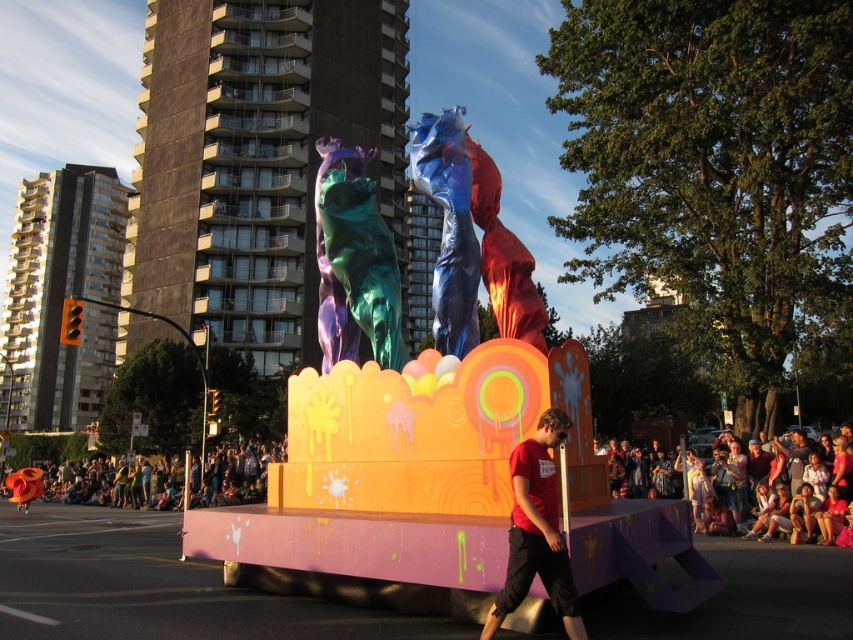
You are a photographer trying to capture the metallic teal bear at center and the matte pink fabric at lower right in the same frame. Based on their heights, which object should you focus on first to ensure both are in the shot?

The metallic teal bear at center is taller than the matte pink fabric at lower right, so you should focus on the metallic teal bear at center first to ensure both are in the shot.